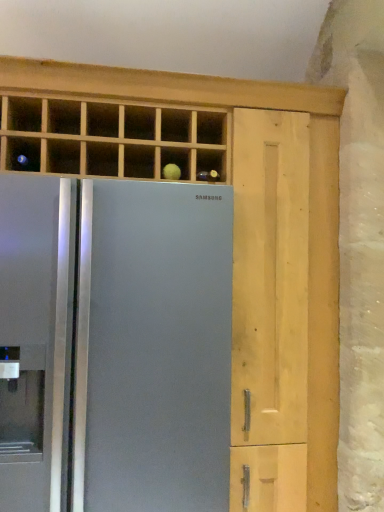
From the picture: Measure the distance between satin silver refrigerator at center and camera.

satin silver refrigerator at center and camera are 1.31 meters apart.

This screenshot has width=384, height=512. What do you see at coordinates (114, 345) in the screenshot? I see `satin silver refrigerator at center` at bounding box center [114, 345].

Image resolution: width=384 pixels, height=512 pixels. I want to click on satin silver refrigerator at center, so pyautogui.click(x=114, y=345).

Locate an element on the screen. Image resolution: width=384 pixels, height=512 pixels. satin silver refrigerator at center is located at coordinates (114, 345).